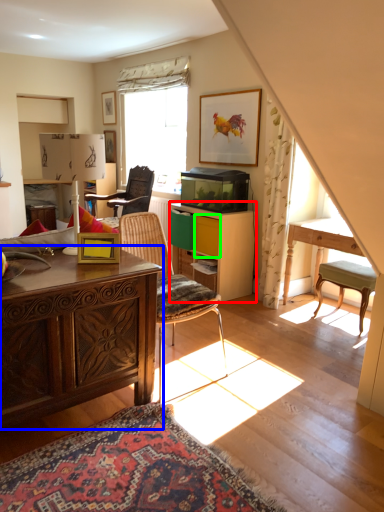
Question: Estimate the real-world distances between objects in this image. Which object is closer to cabinetry (highlighted by a red box), desk (highlighted by a blue box) or drawer (highlighted by a green box)?

Choices:
 (A) desk
 (B) drawer

Answer: (B)